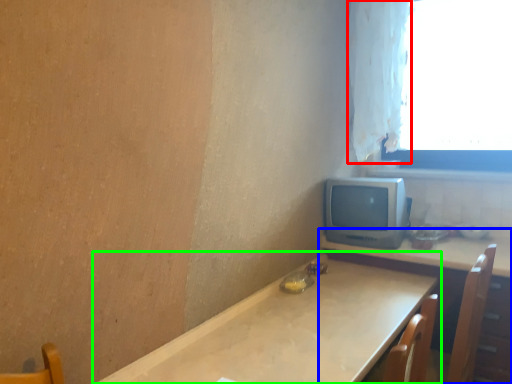
Question: Estimate the real-world distances between objects in this image. Which object is closer to curtain (highlighted by a red box), table (highlighted by a blue box) or table (highlighted by a green box)?

Choices:
 (A) table
 (B) table

Answer: (A)